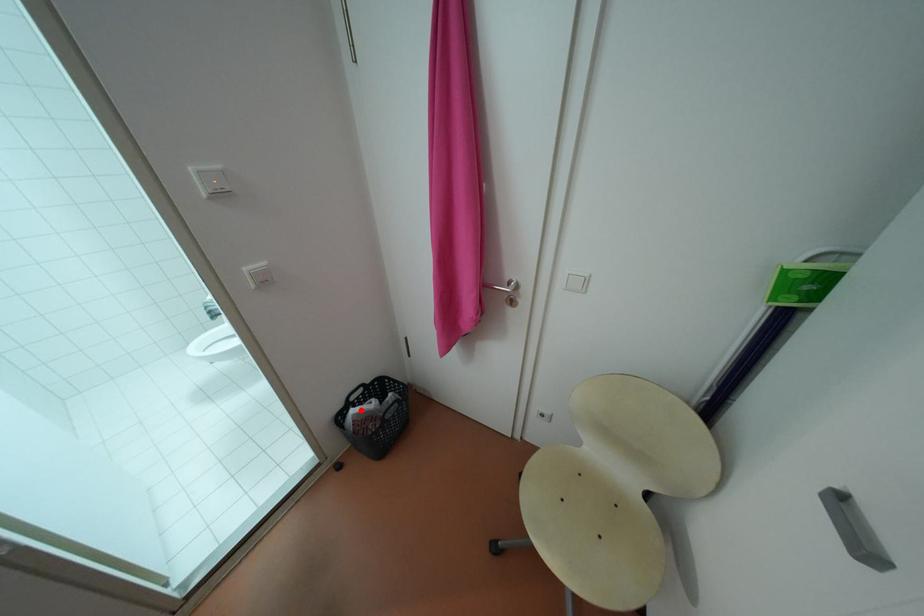
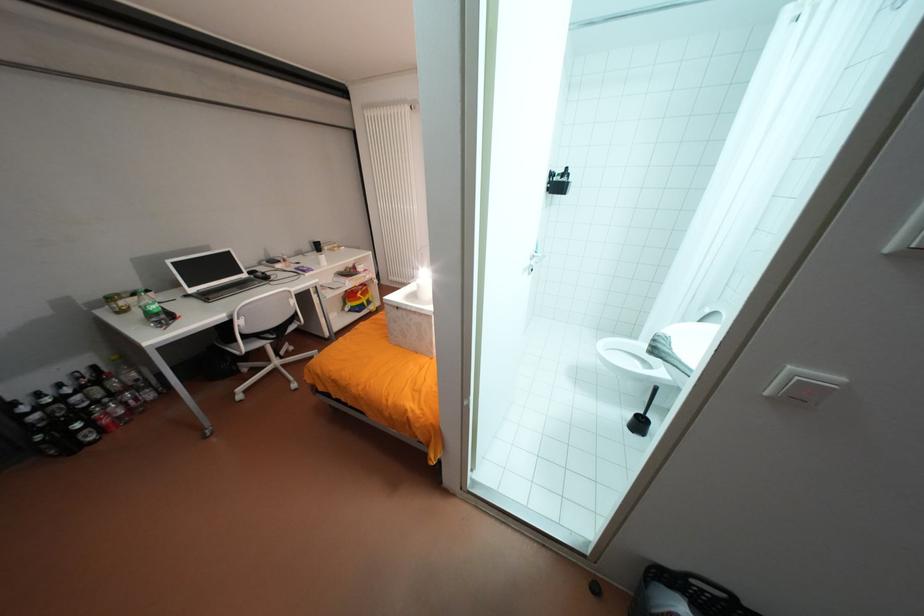
In the second image, find the point that corresponds to the highlighted location in the first image.

(694, 609)